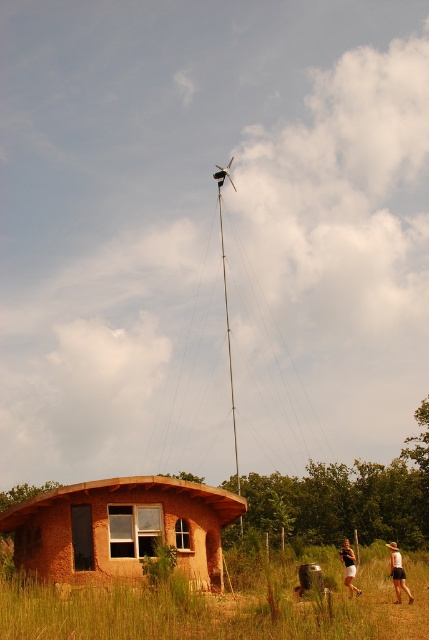
You are standing at the entrance of the rustic structure and want to reach both the tan shorts at lower right and the tan fabric shorts at lower right. Which of these items are closer to you?

Both items are located at the lower right, but the tan shorts at lower right is closer since it is only 7.62 feet away from the tan fabric shorts at lower right.

You are standing in front of the rustic adobe structure and notice the green grass at lower center and the tan shorts at lower right. Which object is positioned higher from the ground?

The green grass at lower center is positioned higher from the ground than the tan shorts at lower right.

You are standing in front of the rustic structure and see a point marked at coordinates (398, 572). Which object in the scene does this point belong to?

The point at coordinates (398, 572) is located on the tan shorts at lower right.